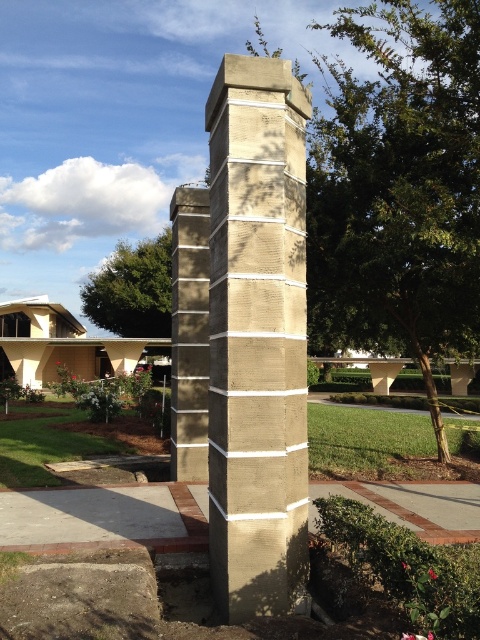
Question: Is concrete textured column at center closer to camera compared to gray concrete at lower left?

Choices:
 (A) yes
 (B) no

Answer: (A)

Question: Can you confirm if sandy concrete column at center is positioned below gray concrete at lower left?

Choices:
 (A) no
 (B) yes

Answer: (A)

Question: Which object is closer to the camera taking this photo?

Choices:
 (A) concrete textured column at center
 (B) gray concrete at lower left
 (C) sandy concrete column at center

Answer: (A)

Question: From the image, what is the correct spatial relationship of sandy concrete column at center in relation to gray concrete at lower left?

Choices:
 (A) above
 (B) below

Answer: (A)

Question: Which object appears farthest from the camera in this image?

Choices:
 (A) gray concrete at lower left
 (B) sandy concrete column at center

Answer: (B)

Question: Which point is farther to the camera?

Choices:
 (A) concrete textured column at center
 (B) gray concrete at lower left

Answer: (B)